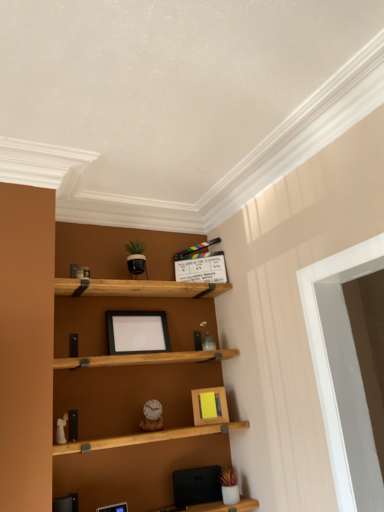
Question: From a real-world perspective, is wooden picture frame at center, the third picture frame from the back, on wooden picture frame at center, placed as the 2th picture frame when sorted from top to bottom?

Choices:
 (A) yes
 (B) no

Answer: (B)

Question: Considering the relative sizes of wooden picture frame at center, the first picture frame positioned from the left, and wooden picture frame at center, which appears as the first picture frame when viewed from the back, in the image provided, is wooden picture frame at center, the first picture frame positioned from the left, shorter than wooden picture frame at center, which appears as the first picture frame when viewed from the back,?

Choices:
 (A) no
 (B) yes

Answer: (B)

Question: Considering the relative sizes of wooden picture frame at center, the 3th picture frame from the right, and wooden picture frame at center, which appears as the first picture frame when viewed from the back, in the image provided, is wooden picture frame at center, the 3th picture frame from the right, thinner than wooden picture frame at center, which appears as the first picture frame when viewed from the back,?

Choices:
 (A) no
 (B) yes

Answer: (A)

Question: Is wooden picture frame at center, the first picture frame positioned from the left, outside wooden picture frame at center, placed as the 2th picture frame when sorted from top to bottom?

Choices:
 (A) yes
 (B) no

Answer: (A)

Question: Does wooden picture frame at center, the 3th picture frame from the right, have a smaller size compared to wooden picture frame at center, the 2th picture frame in the bottom-to-top sequence?

Choices:
 (A) no
 (B) yes

Answer: (B)

Question: Can you confirm if wooden picture frame at center, the third picture frame from the back, is taller than wooden picture frame at center, which is counted as the 3th picture frame, starting from the left?

Choices:
 (A) no
 (B) yes

Answer: (A)

Question: Can you confirm if white glossy door at right is bigger than wooden picture frame at center, positioned as the 1th picture frame in front-to-back order?

Choices:
 (A) yes
 (B) no

Answer: (A)

Question: Are white glossy door at right and wooden picture frame at center, the third picture frame from the back, located far from each other?

Choices:
 (A) yes
 (B) no

Answer: (A)

Question: Considering the relative sizes of white glossy door at right and wooden picture frame at center, positioned as the 1th picture frame in front-to-back order, in the image provided, is white glossy door at right shorter than wooden picture frame at center, positioned as the 1th picture frame in front-to-back order,?

Choices:
 (A) no
 (B) yes

Answer: (A)

Question: From a real-world perspective, is white glossy door at right over wooden picture frame at center, the first picture frame positioned from the left?

Choices:
 (A) no
 (B) yes

Answer: (B)

Question: Considering the relative positions of white glossy door at right and wooden picture frame at center, positioned as the 1th picture frame in front-to-back order, in the image provided, is white glossy door at right behind wooden picture frame at center, positioned as the 1th picture frame in front-to-back order,?

Choices:
 (A) no
 (B) yes

Answer: (A)

Question: Can you confirm if white glossy door at right is thinner than wooden picture frame at center, the first picture frame when ordered from bottom to top?

Choices:
 (A) yes
 (B) no

Answer: (B)

Question: Is black matte picture frame at center, which is the second picture frame in left-to-right order, facing away from wooden picture frame at center, the 2th picture frame in the bottom-to-top sequence?

Choices:
 (A) no
 (B) yes

Answer: (A)